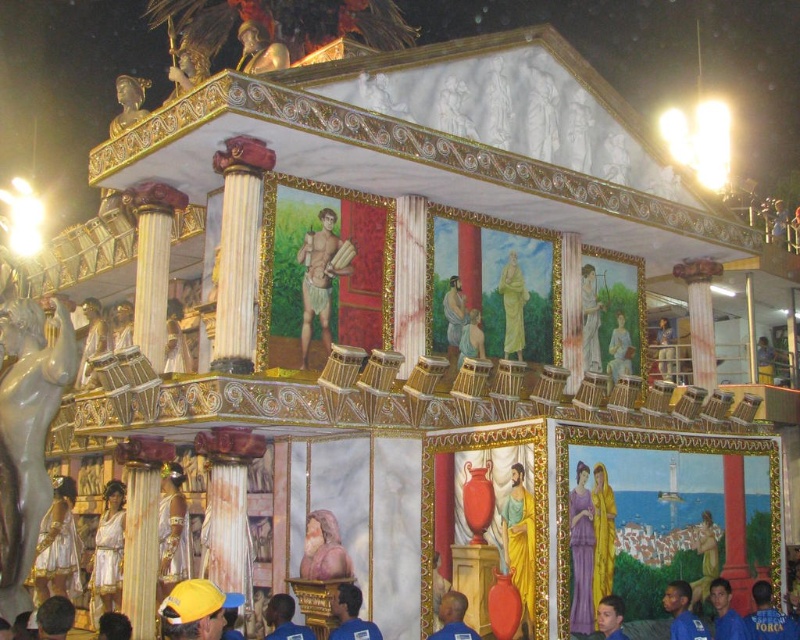
Is purple silk dress at center-right thinner than smooth white statue at upper center?

No.

Does purple silk dress at center-right lie in front of smooth white statue at upper center?

Yes, it is.

Where is `purple silk dress at center-right`? purple silk dress at center-right is located at coordinates (582, 554).

Between golden fabric figure at center and smooth white statue at upper center, which one appears on the right side from the viewer's perspective?

smooth white statue at upper center is more to the right.

Is point (513, 516) positioned before point (590, 268)?

Yes, it is in front of point (590, 268).

Between point (516, 531) and point (590, 314), which one is positioned in front?

Point (516, 531)

The width and height of the screenshot is (800, 640). Identify the location of golden fabric figure at center. (520, 545).

Which is behind, point (600, 365) or point (668, 353)?

The point (668, 353) is behind.

Between smooth white statue at upper center and smooth gold statue at upper right, which one appears on the left side from the viewer's perspective?

From the viewer's perspective, smooth white statue at upper center appears more on the left side.

Image resolution: width=800 pixels, height=640 pixels. In order to click on smooth white statue at upper center in this screenshot , I will do `click(590, 320)`.

You are a GUI agent. You are given a task and a screenshot of the screen. Output one action in this format:
    pyautogui.click(x=<x>, y=<y>)
    Task: Click on the smooth white statue at upper center
    This screenshot has width=800, height=640.
    Given the screenshot: What is the action you would take?
    pyautogui.click(x=590, y=320)